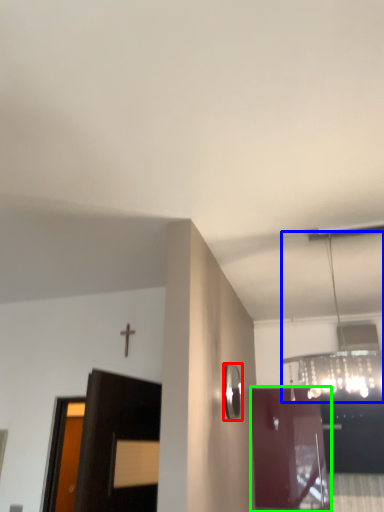
Question: Estimate the real-world distances between objects in this image. Which object is farther from mirror (highlighted by a red box), light fixture (highlighted by a blue box) or door (highlighted by a green box)?

Choices:
 (A) light fixture
 (B) door

Answer: (B)